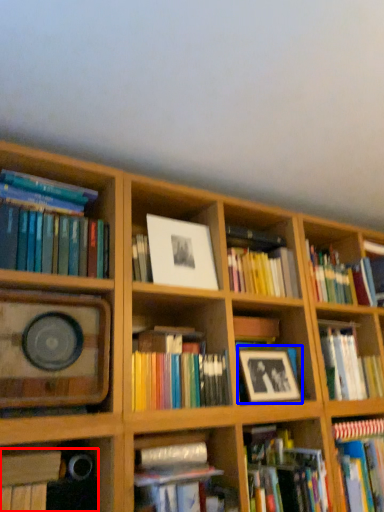
Question: Which object appears farthest to the camera in this image, book (highlighted by a red box) or picture frame (highlighted by a blue box)?

Choices:
 (A) book
 (B) picture frame

Answer: (B)